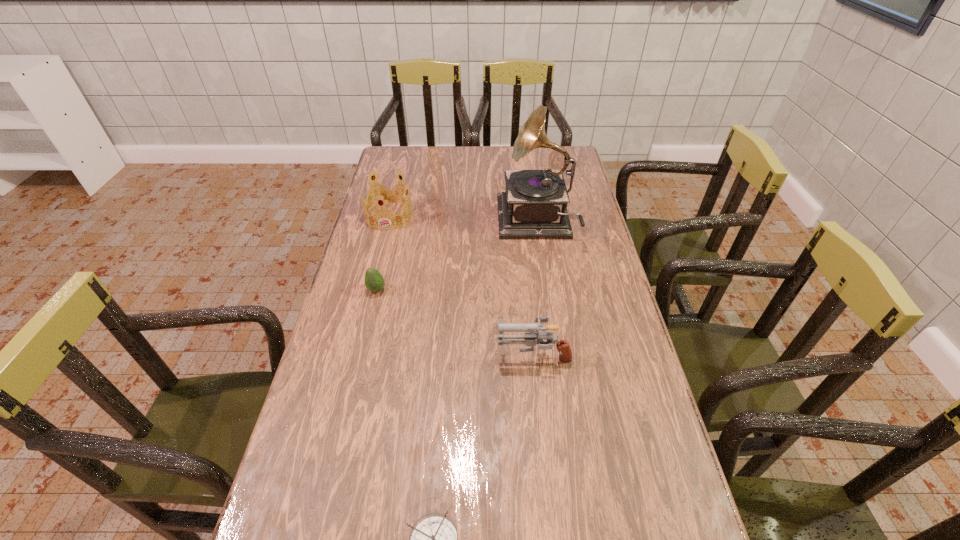
Identify the location of unoccupied area between the crown and the tallest object. (463, 219).

Locate an element on the screen. This screenshot has width=960, height=540. blank region between the avocado and the crown is located at coordinates (383, 253).

The image size is (960, 540). In order to click on free space between the crown and the third nearest object in this screenshot , I will do `click(383, 253)`.

Identify which object is located as the nearest to the third nearest object. Please provide its 2D coordinates. Your answer should be formatted as a tuple, i.e. [(x, y)], where the tuple contains the x and y coordinates of a point satisfying the conditions above.

[(385, 195)]

Identify the location of object that ranks as the second closest to the third nearest object. Image resolution: width=960 pixels, height=540 pixels. (532, 339).